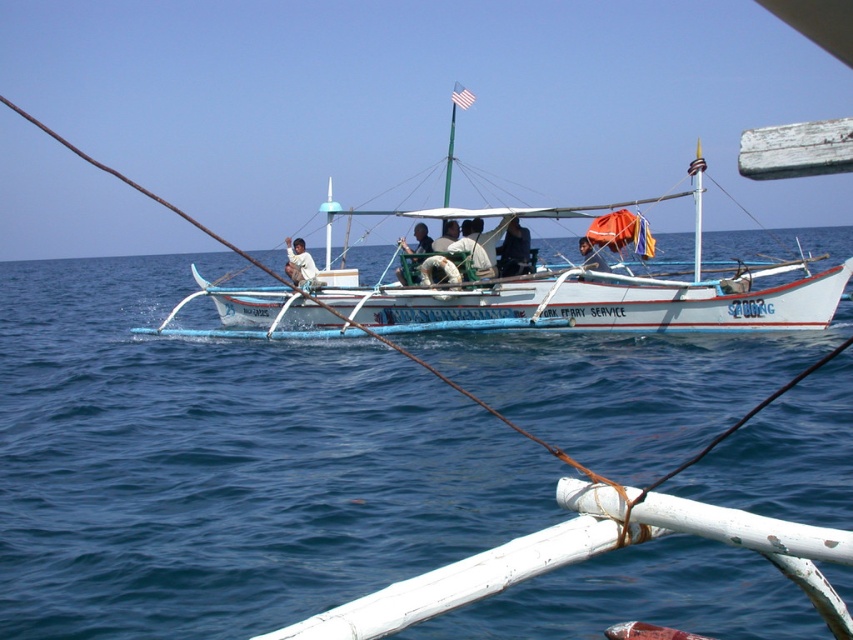
Based on the photo, is dark blue fabric at center shorter than light brown wooden chair at center?

In fact, dark blue fabric at center may be taller than light brown wooden chair at center.

Does dark blue fabric at center come in front of light brown wooden chair at center?

Yes.

Identify the location of dark blue fabric at center. (514, 250).

Can you confirm if light brown woven hat at center is positioned to the right of light brown wooden chair at center?

Indeed, light brown woven hat at center is positioned on the right side of light brown wooden chair at center.

Who is shorter, light brown woven hat at center or light brown wooden chair at center?

Standing shorter between the two is light brown wooden chair at center.

Describe the element at coordinates (474, 248) in the screenshot. I see `light brown woven hat at center` at that location.

Identify the location of light brown woven hat at center. (474, 248).

Does blue water at center come in front of white wooden boat at center?

That is True.

Is blue water at center bigger than white wooden boat at center?

Indeed, blue water at center has a larger size compared to white wooden boat at center.

Is point (585, 365) positioned behind point (393, 310)?

No.

Find the location of a particular element. blue water at center is located at coordinates (224, 465).